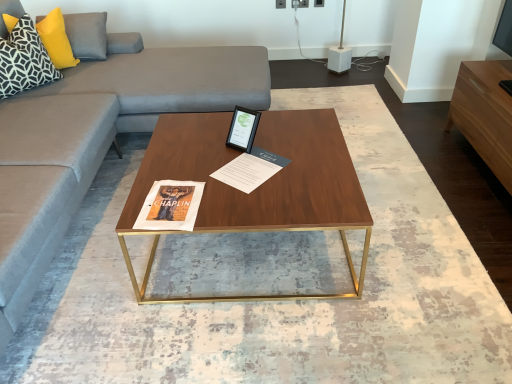
Locate an element on the screen. The width and height of the screenshot is (512, 384). vacant area that is in front of matte paper magazine at center is located at coordinates (251, 199).